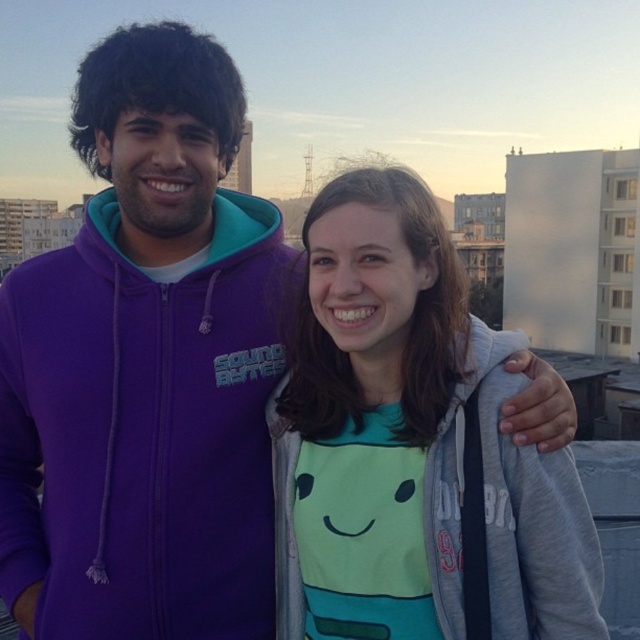
Question: In this image, where is purple fleece jacket at center located relative to light gray hoodie at center?

Choices:
 (A) below
 (B) above

Answer: (B)

Question: Is purple fleece jacket at center above light gray hoodie at center?

Choices:
 (A) no
 (B) yes

Answer: (B)

Question: Which object is closer to the camera taking this photo?

Choices:
 (A) purple fleece jacket at center
 (B) light gray hoodie at center

Answer: (B)

Question: In this image, where is purple fleece jacket at center located relative to light gray hoodie at center?

Choices:
 (A) left
 (B) right

Answer: (A)